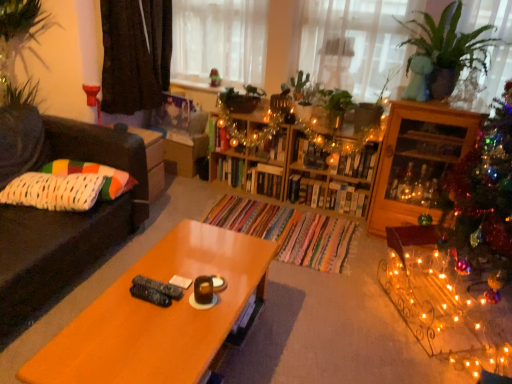
This screenshot has height=384, width=512. Find the location of `free location to the left of wooden cabinet at right`. free location to the left of wooden cabinet at right is located at coordinates (332, 230).